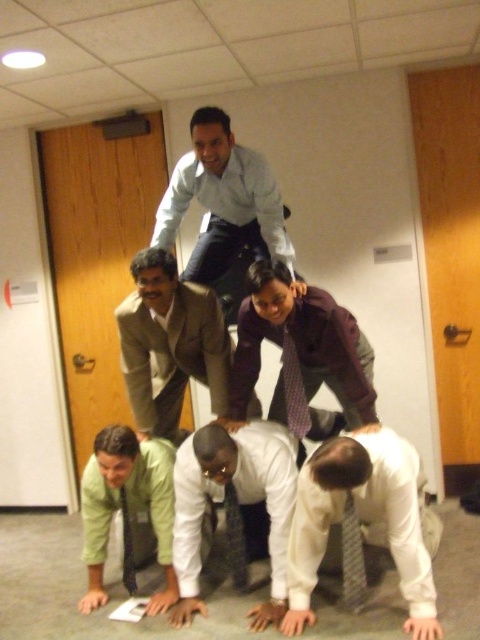
Question: Where is maroon textured blazer at center located in relation to green fabric shirt at lower left in the image?

Choices:
 (A) left
 (B) right

Answer: (B)

Question: Among these points, which one is farthest from the camera?

Choices:
 (A) (236, 221)
 (B) (418, 584)
 (C) (123, 506)
 (D) (305, 426)

Answer: (A)

Question: Which point is farther to the camera?

Choices:
 (A) patterned silk tie at center
 (B) dark purple textured tie at center

Answer: (A)

Question: Can you confirm if light brown suit at center is positioned above green fabric shirt at lower left?

Choices:
 (A) yes
 (B) no

Answer: (A)

Question: Which point is closer to the camera?

Choices:
 (A) patterned silk tie at center
 (B) light blue shirt at center

Answer: (B)

Question: Is white matte shirt at lower right above light blue shirt at center?

Choices:
 (A) yes
 (B) no

Answer: (B)